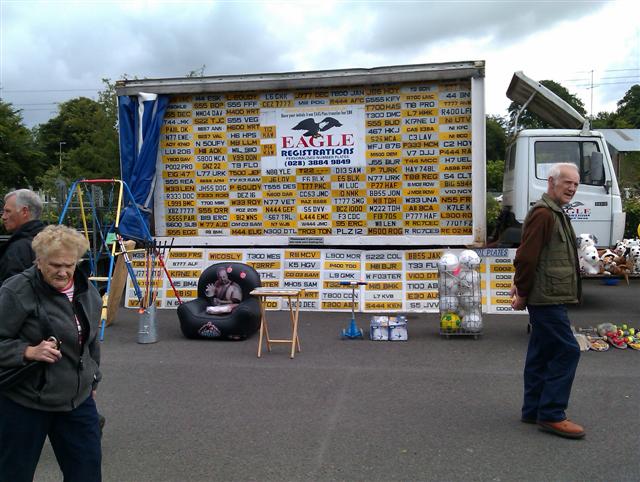
You are a GUI agent. You are given a task and a screenshot of the screen. Output one action in this format:
    pyautogui.click(x=<x>, y=<y>)
    Task: Click on the curtain
    The height and width of the screenshot is (482, 640).
    Given the screenshot: What is the action you would take?
    pyautogui.click(x=141, y=168)